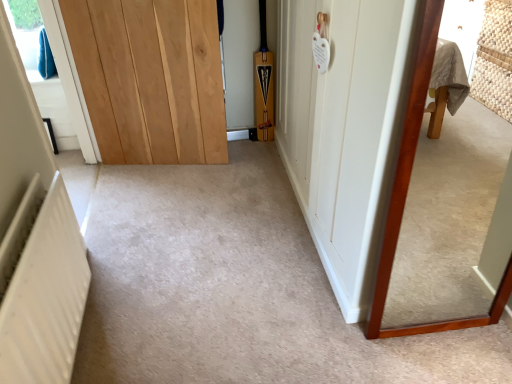
What is the approximate width of white textured radiator at lower left?

white textured radiator at lower left is 3.63 inches wide.

Identify the location of white wood door at center, the first door from the right. The image size is (512, 384). (342, 128).

This screenshot has height=384, width=512. Describe the element at coordinates (56, 70) in the screenshot. I see `white plastic radiator at lower left` at that location.

What are the coordinates of `white plastic radiator at lower left` in the screenshot? It's located at (56, 70).

I want to click on white textured radiator at lower left, so click(42, 287).

From the image's perspective, is white plastic radiator at lower left above white wood door at center, which is the second door from left to right?

No, from the image's perspective, white plastic radiator at lower left is not over white wood door at center, which is the second door from left to right.

Considering the sizes of white plastic radiator at lower left and white wood door at center, which is the second door from left to right, in the image, is white plastic radiator at lower left taller or shorter than white wood door at center, which is the second door from left to right,?

In the image, white plastic radiator at lower left appears to be shorter than white wood door at center, which is the second door from left to right.

Where is `window located underneath the white wood door at center, which is the second door from left to right (from a real-world perspective)`? The height and width of the screenshot is (384, 512). window located underneath the white wood door at center, which is the second door from left to right (from a real-world perspective) is located at coordinates 56,70.

Is white plastic radiator at lower left facing away from white wood door at center, the first door from the right?

white plastic radiator at lower left is not turned away from white wood door at center, the first door from the right.

Between point (223, 137) and point (421, 49), which one is positioned in front?

Positioned in front is point (421, 49).

From the image's perspective, which one is positioned higher, light brown wood door at center, the 1th door from the left, or wooden-framed mirror at right?

From the image's view, light brown wood door at center, the 1th door from the left, is above.

Consider the image. Considering the sizes of light brown wood door at center, the 1th door from the left, and wooden-framed mirror at right in the image, is light brown wood door at center, the 1th door from the left, wider or thinner than wooden-framed mirror at right?

Clearly, light brown wood door at center, the 1th door from the left, has more width compared to wooden-framed mirror at right.

Is point (444, 178) behind point (338, 77)?

Yes, it is.

From the image's perspective, is wooden-framed mirror at right over white wood door at center, the first door from the right?

No.

You are a GUI agent. You are given a task and a screenshot of the screen. Output one action in this format:
    pyautogui.click(x=<x>, y=<y>)
    Task: Click on the mirror in front of the white wood door at center, which is the second door from left to right
    The image size is (512, 384).
    Given the screenshot: What is the action you would take?
    pyautogui.click(x=441, y=216)

From a real-world perspective, is wooden-framed mirror at right located beneath light brown wood door at center, the 1th door from the left?

No, from a real-world perspective, wooden-framed mirror at right is not under light brown wood door at center, the 1th door from the left.

Is light brown wood door at center, the 1th door from the left, located within wooden-framed mirror at right?

No, light brown wood door at center, the 1th door from the left, is not inside wooden-framed mirror at right.

Which object is further away from the camera, wooden-framed mirror at right or light brown wood door at center, the 1th door from the left?

light brown wood door at center, the 1th door from the left, is behind.

Considering the sizes of white wood door at center, which is the second door from left to right, and white textured radiator at lower left in the image, is white wood door at center, which is the second door from left to right, taller or shorter than white textured radiator at lower left?

white wood door at center, which is the second door from left to right, is taller than white textured radiator at lower left.

From a real-world perspective, is white wood door at center, the first door from the right, located higher than white textured radiator at lower left?

Yes, from a real-world perspective, white wood door at center, the first door from the right, is above white textured radiator at lower left.

Would you say white wood door at center, the first door from the right, contains white textured radiator at lower left?

Actually, white textured radiator at lower left is outside white wood door at center, the first door from the right.

From the picture: Can you tell me how much light brown wood door at center, the 2th door from the right, and white textured radiator at lower left differ in facing direction?

They differ by 99.7 degrees in their facing directions.

From the picture: Is light brown wood door at center, the 2th door from the right, positioned with its back to white textured radiator at lower left?

No, light brown wood door at center, the 2th door from the right, is not facing the opposite direction of white textured radiator at lower left.

From the picture: Is light brown wood door at center, the 1th door from the left, positioned before white textured radiator at lower left?

No.

Could you measure the distance between light brown wood door at center, the 1th door from the left, and white textured radiator at lower left?

3.57 feet.

Which object is more forward, white textured radiator at lower left or white wood door at center, the first door from the right?

white textured radiator at lower left.

From a real-world perspective, is white textured radiator at lower left positioned over white wood door at center, which is the second door from left to right, based on gravity?

No, from a real-world perspective, white textured radiator at lower left is not over white wood door at center, which is the second door from left to right

Between white textured radiator at lower left and white wood door at center, the first door from the right, which one has smaller width?

white textured radiator at lower left is thinner.

Where is `door that is the 1st one when counting upward from the white plastic radiator at lower left (from the image's perspective)`? This screenshot has width=512, height=384. door that is the 1st one when counting upward from the white plastic radiator at lower left (from the image's perspective) is located at coordinates (342, 128).

Which door is the 2nd one when counting from the back of the wooden-framed mirror at right? Please provide its 2D coordinates.

[(150, 78)]

From the image, which object appears to be farther from light brown wood door at center, the 1th door from the left, wooden-framed mirror at right or white textured radiator at lower left?

The object further to light brown wood door at center, the 1th door from the left, is wooden-framed mirror at right.

Considering their positions, is white plastic radiator at lower left positioned further to wooden-framed mirror at right than light brown wood door at center, the 1th door from the left?

Based on the image, white plastic radiator at lower left appears to be further to wooden-framed mirror at right.

Based on the photo, based on their spatial positions, is light brown wood door at center, the 2th door from the right, or white wood door at center, which is the second door from left to right, closer to white textured radiator at lower left?

white wood door at center, which is the second door from left to right, is positioned closer to the anchor white textured radiator at lower left.

Based on their spatial positions, is light brown wood door at center, the 1th door from the left, or white textured radiator at lower left closer to wooden-framed mirror at right?

The object closer to wooden-framed mirror at right is white textured radiator at lower left.

Consider the image. When comparing their distances from white plastic radiator at lower left, does light brown wood door at center, the 2th door from the right, or white textured radiator at lower left seem further?

Based on the image, white textured radiator at lower left appears to be further to white plastic radiator at lower left.

Based on their spatial positions, is white textured radiator at lower left or white wood door at center, which is the second door from left to right, further from light brown wood door at center, the 1th door from the left?

white textured radiator at lower left.

Which object lies further to the anchor point light brown wood door at center, the 1th door from the left, wooden-framed mirror at right or white wood door at center, which is the second door from left to right?

wooden-framed mirror at right is further to light brown wood door at center, the 1th door from the left.

Considering their positions, is white plastic radiator at lower left positioned further to white textured radiator at lower left than white wood door at center, the first door from the right?

white plastic radiator at lower left lies further to white textured radiator at lower left than the other object.

You are a GUI agent. You are given a task and a screenshot of the screen. Output one action in this format:
    pyautogui.click(x=<x>, y=<y>)
    Task: Click on the radiator between white plastic radiator at lower left and wooden-framed mirror at right in the horizontal direction
    The image size is (512, 384).
    Given the screenshot: What is the action you would take?
    pyautogui.click(x=42, y=287)

The height and width of the screenshot is (384, 512). Identify the location of door between white plastic radiator at lower left and white wood door at center, which is the second door from left to right, from left to right. (150, 78).

I want to click on door between light brown wood door at center, the 2th door from the right, and wooden-framed mirror at right from left to right, so click(342, 128).

The width and height of the screenshot is (512, 384). I want to click on radiator situated between white plastic radiator at lower left and white wood door at center, which is the second door from left to right, from left to right, so click(42, 287).